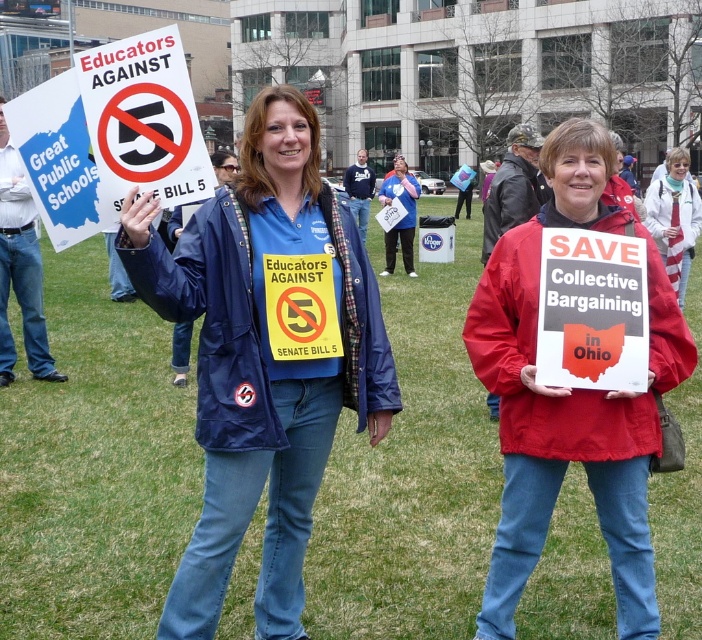
Is point (581, 304) less distant than point (399, 179)?

Yes.

In the scene shown: Who is lower down, red paper sign at center or blue fabric shirt at center?

red paper sign at center is below.

Does point (640, 365) come in front of point (395, 170)?

Yes, point (640, 365) is closer to viewer.

Find the location of `red paper sign at center`. red paper sign at center is located at coordinates (592, 310).

Is point (98, 134) behind point (585, 372)?

No, it is not.

Which is behind, point (110, 58) or point (628, 296)?

Positioned behind is point (628, 296).

Who is more forward, (133, 115) or (562, 292)?

Positioned in front is point (133, 115).

Where is `white paper sign at upper left`? Image resolution: width=702 pixels, height=640 pixels. white paper sign at upper left is located at coordinates (143, 120).

Which of these two, green grass at center or blue fabric jacket at center, stands shorter?

blue fabric jacket at center is shorter.

Can you confirm if green grass at center is wider than blue fabric jacket at center?

Yes.

Identify the location of green grass at center. This screenshot has width=702, height=640. (93, 465).